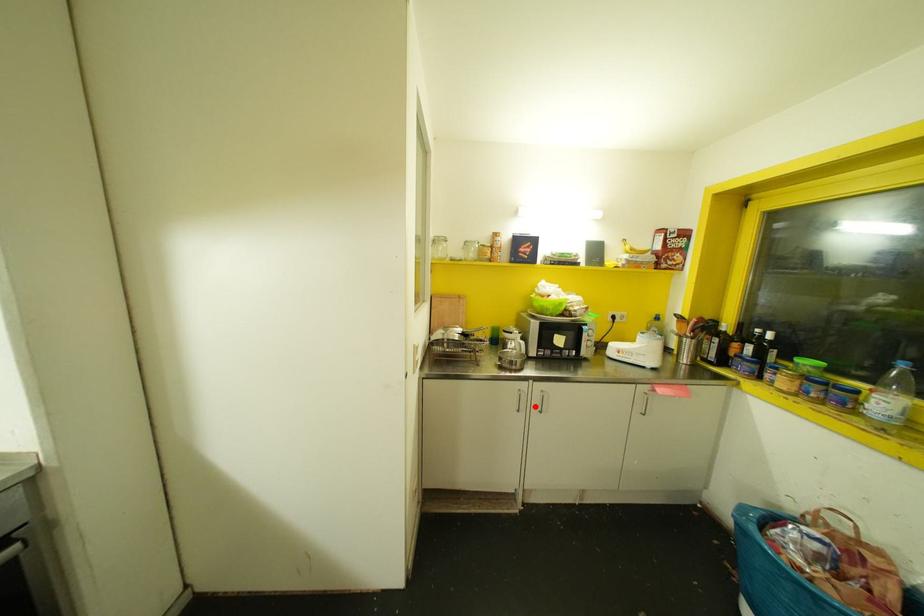
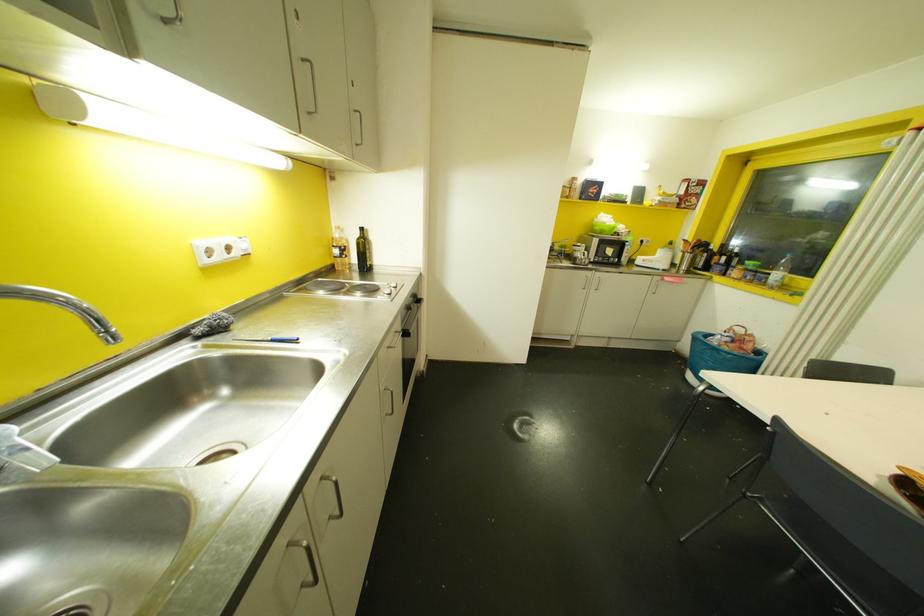
Find the pixel in the second image that matches the highlighted location in the first image.

(592, 286)